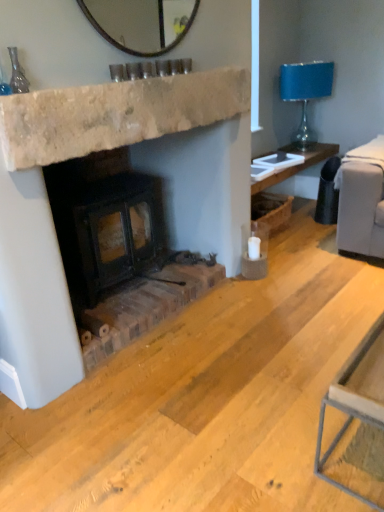
Question: Considering the relative positions of blue glass lampshade at upper right and rustic brick wood burning stove at center in the image provided, is blue glass lampshade at upper right to the right of rustic brick wood burning stove at center from the viewer's perspective?

Choices:
 (A) no
 (B) yes

Answer: (B)

Question: Is blue glass lampshade at upper right far away from rustic brick wood burning stove at center?

Choices:
 (A) no
 (B) yes

Answer: (B)

Question: From the image's perspective, is blue glass lampshade at upper right above rustic brick wood burning stove at center?

Choices:
 (A) no
 (B) yes

Answer: (B)

Question: Is blue glass lampshade at upper right in contact with rustic brick wood burning stove at center?

Choices:
 (A) yes
 (B) no

Answer: (B)

Question: Does blue glass lampshade at upper right have a lesser width compared to rustic brick wood burning stove at center?

Choices:
 (A) no
 (B) yes

Answer: (B)

Question: Does blue glass lampshade at upper right come behind rustic brick wood burning stove at center?

Choices:
 (A) yes
 (B) no

Answer: (A)

Question: From a real-world perspective, is natural stone fireplace at center physically above rustic brick wood burning stove at center?

Choices:
 (A) no
 (B) yes

Answer: (B)

Question: From the image's perspective, is natural stone fireplace at center above rustic brick wood burning stove at center?

Choices:
 (A) no
 (B) yes

Answer: (B)

Question: From the image's perspective, is natural stone fireplace at center below rustic brick wood burning stove at center?

Choices:
 (A) yes
 (B) no

Answer: (B)

Question: Is natural stone fireplace at center turned away from rustic brick wood burning stove at center?

Choices:
 (A) yes
 (B) no

Answer: (B)

Question: Is rustic brick wood burning stove at center inside natural stone fireplace at center?

Choices:
 (A) yes
 (B) no

Answer: (B)

Question: Is the position of natural stone fireplace at center more distant than that of rustic brick wood burning stove at center?

Choices:
 (A) yes
 (B) no

Answer: (B)

Question: Are rustic brick wood burning stove at center and natural stone fireplace at center far apart?

Choices:
 (A) yes
 (B) no

Answer: (B)